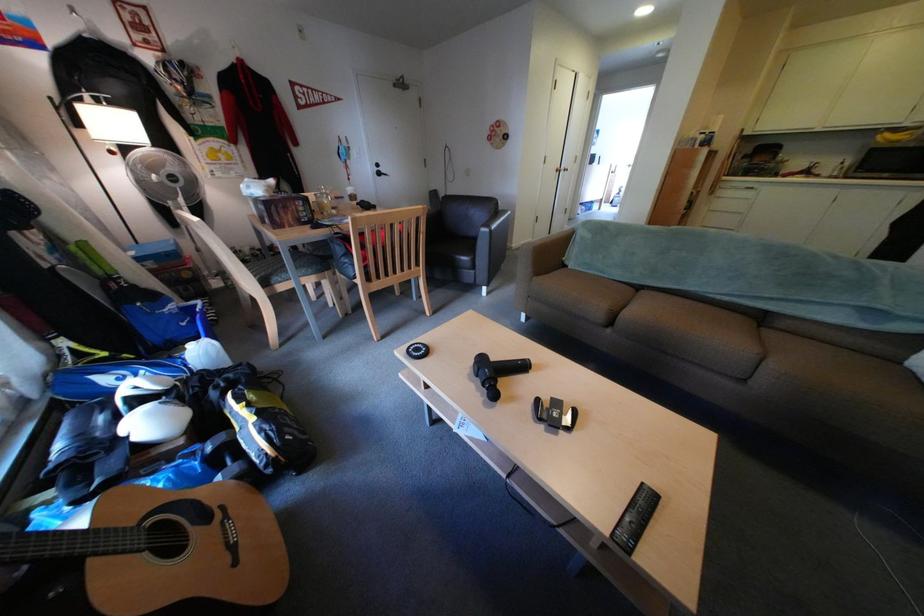
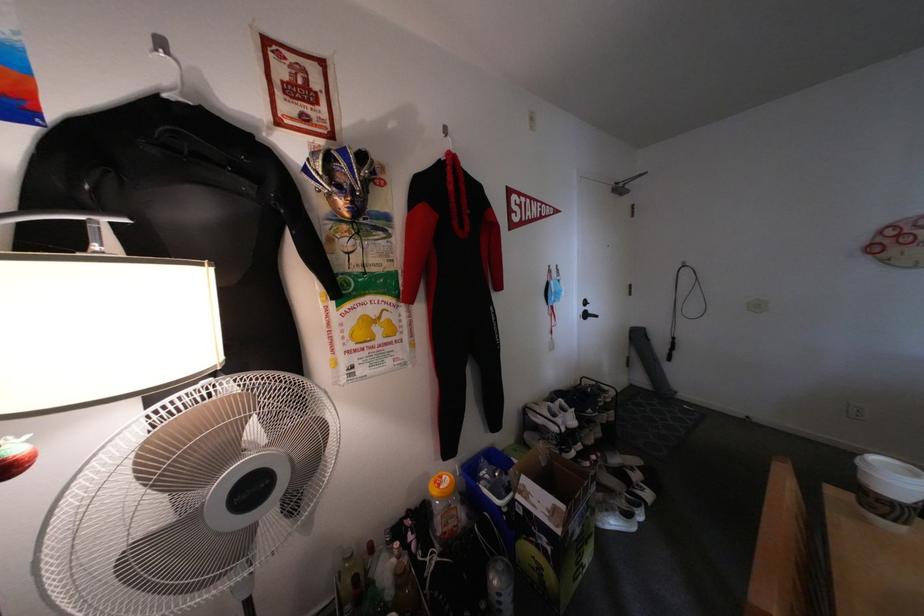
Find the pixel in the second image that matches (x=227, y=108) in the first image.

(404, 237)